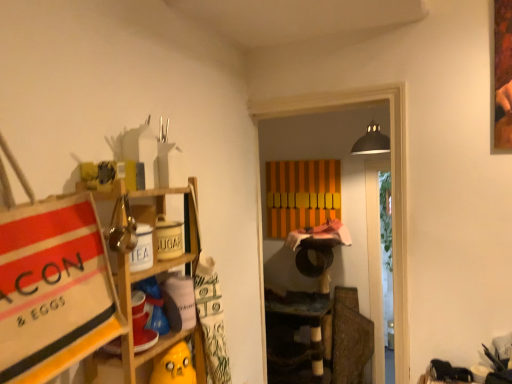
Question: Would you say orange striped cabinet at center is outside wooden shelf at left?

Choices:
 (A) no
 (B) yes

Answer: (B)

Question: Is orange striped cabinet at center placed right next to wooden shelf at left?

Choices:
 (A) no
 (B) yes

Answer: (A)

Question: From the image's perspective, would you say orange striped cabinet at center is positioned over wooden shelf at left?

Choices:
 (A) yes
 (B) no

Answer: (A)

Question: Is there a large distance between orange striped cabinet at center and wooden shelf at left?

Choices:
 (A) no
 (B) yes

Answer: (B)

Question: Does orange striped cabinet at center have a greater width compared to wooden shelf at left?

Choices:
 (A) yes
 (B) no

Answer: (B)

Question: Is orange striped cabinet at center behind wooden shelf at left?

Choices:
 (A) no
 (B) yes

Answer: (B)

Question: Considering the relative sizes of wooden shelf at left and orange striped cabinet at center in the image provided, is wooden shelf at left thinner than orange striped cabinet at center?

Choices:
 (A) yes
 (B) no

Answer: (B)

Question: From a real-world perspective, is wooden shelf at left positioned over orange striped cabinet at center based on gravity?

Choices:
 (A) yes
 (B) no

Answer: (B)

Question: Considering the relative positions of wooden shelf at left and orange striped cabinet at center in the image provided, is wooden shelf at left to the right of orange striped cabinet at center from the viewer's perspective?

Choices:
 (A) no
 (B) yes

Answer: (A)

Question: Is wooden shelf at left touching orange striped cabinet at center?

Choices:
 (A) yes
 (B) no

Answer: (B)

Question: From the image's perspective, would you say wooden shelf at left is shown under orange striped cabinet at center?

Choices:
 (A) no
 (B) yes

Answer: (B)

Question: From a real-world perspective, is wooden shelf at left located beneath orange striped cabinet at center?

Choices:
 (A) no
 (B) yes

Answer: (B)

Question: Is wooden shelf at left spatially inside orange striped cabinet at center, or outside of it?

Choices:
 (A) outside
 (B) inside

Answer: (A)